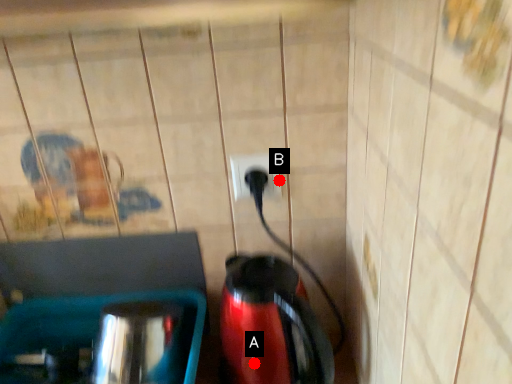
Question: Two points are circled on the image, labeled by A and B beside each circle. Which of the following is the closest to the observer?

Choices:
 (A) A is closer
 (B) B is closer

Answer: (A)